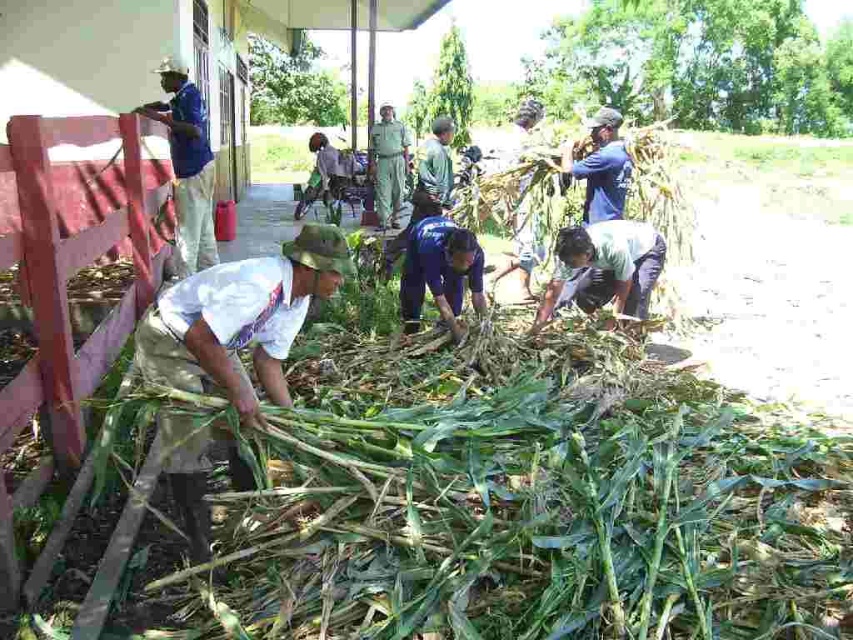
Between green fabric shirt at lower center and blue uniform at center, which one appears on the left side from the viewer's perspective?

From the viewer's perspective, blue uniform at center appears more on the left side.

Does point (550, 298) come behind point (424, 268)?

Yes.

Is point (625, 262) closer to camera compared to point (402, 291)?

Yes, it is.

Find the location of a particular element. green fabric shirt at lower center is located at coordinates (602, 268).

Which is more to the left, blue uniform at center or green uniform at center?

From the viewer's perspective, green uniform at center appears more on the left side.

Is blue uniform at center taller than green uniform at center?

No, blue uniform at center is not taller than green uniform at center.

Is point (466, 273) positioned before point (386, 115)?

That is True.

Find the location of `blue uniform at center`. blue uniform at center is located at coordinates (440, 272).

Can you confirm if green fabric shirt at lower center is taller than green uniform at center?

No, green fabric shirt at lower center is not taller than green uniform at center.

Is green fabric shirt at lower center wider than green uniform at center?

Indeed, green fabric shirt at lower center has a greater width compared to green uniform at center.

Between point (604, 291) and point (389, 196), which one is positioned behind?

Positioned behind is point (389, 196).

The image size is (853, 640). I want to click on green fabric shirt at lower center, so (x=602, y=268).